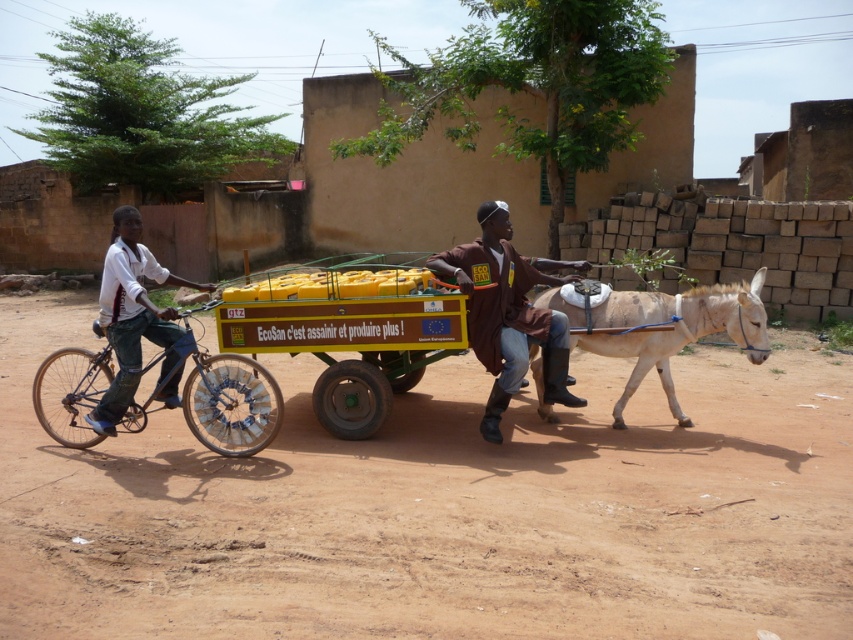
Looking at this image, you are a traveler who needs to cross the brown dirt field at center and the brown leather jacket at center. Which one can you walk through?

The brown dirt field at center is larger in size than the brown leather jacket at center, so you can walk through the brown dirt field at center but not the brown leather jacket at center.

You are standing at the edge of the brown dirt field at center and looking towards the brown leather jacket at center. Which object is closer to your feet?

The brown dirt field at center is closer to your feet because it is positioned below the brown leather jacket at center, meaning it is lower in elevation.